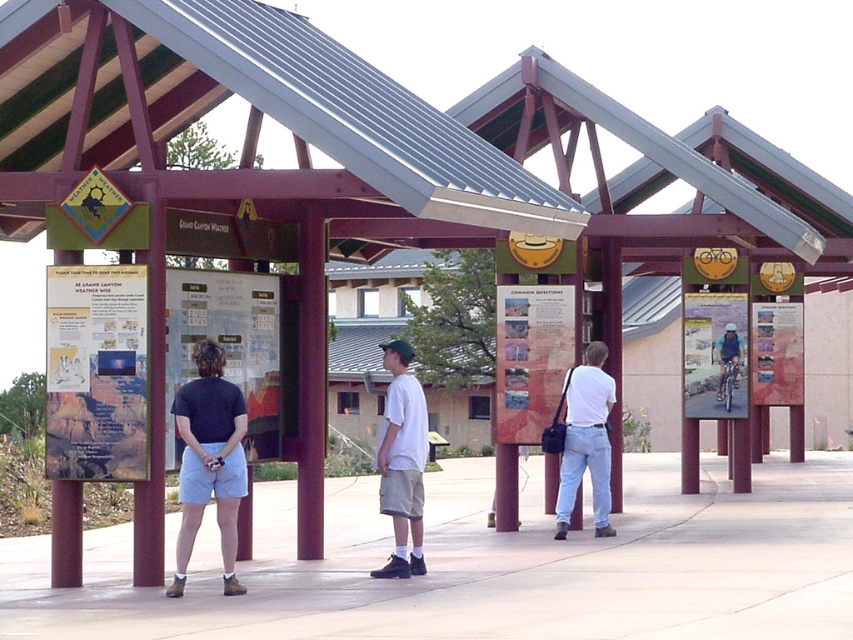
Question: Is the position of white cotton shirt at center less distant than that of white matte shirt at center?

Choices:
 (A) no
 (B) yes

Answer: (B)

Question: Which point is farther from the camera taking this photo?

Choices:
 (A) (405, 458)
 (B) (241, 592)
 (C) (590, 467)

Answer: (C)

Question: Does white cotton shirt at center lie in front of white matte shirt at center?

Choices:
 (A) no
 (B) yes

Answer: (B)

Question: Estimate the real-world distances between objects in this image. Which object is closer to the light blue denim shorts at center?

Choices:
 (A) white cotton shirt at center
 (B) white matte shirt at center

Answer: (A)

Question: Is light blue denim shorts at center to the left of white cotton shirt at center from the viewer's perspective?

Choices:
 (A) yes
 (B) no

Answer: (A)

Question: Which of the following is the closest to the observer?

Choices:
 (A) (383, 433)
 (B) (590, 433)
 (C) (408, 538)

Answer: (A)